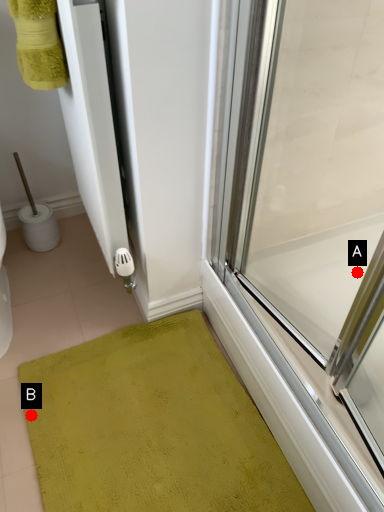
Question: Two points are circled on the image, labeled by A and B beside each circle. Among these points, which one is farthest from the camera?

Choices:
 (A) A is further
 (B) B is further

Answer: (A)